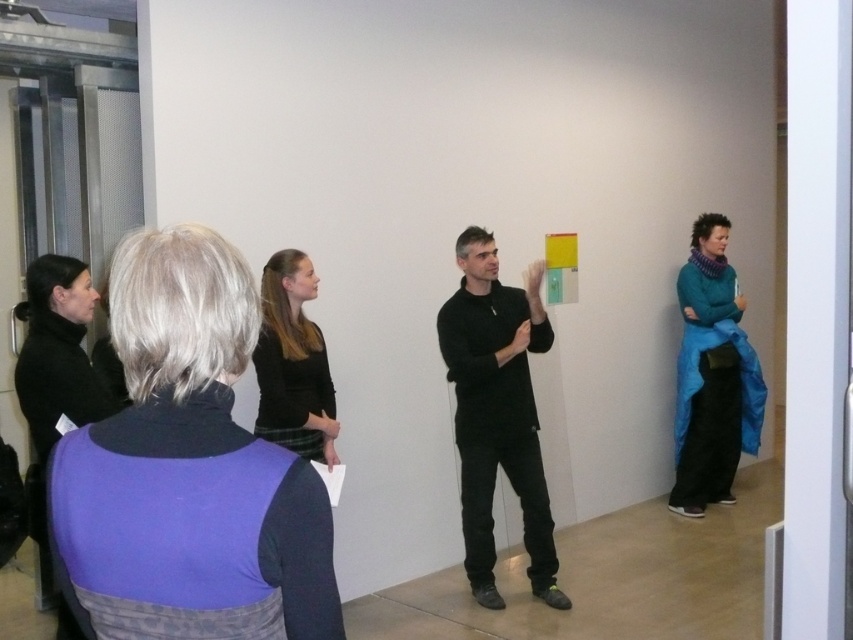
You are an art gallery visitor who wants to take a photo of the blue fabric coat at right without including the black matte shirt at center in the frame. Is it possible to do so by moving only to your right side?

The black matte shirt at center is to the left of blue fabric coat at right, so moving to your right side may allow you to exclude the black matte shirt at center from the frame depending on the distance between them and your camera angle.

You are an artist trying to decide where to place your new sculpture in the gallery. You have two options near the purple fabric vest at lower left and the blue fabric coat at right. Which location is closer to the left wall?

The purple fabric vest at lower left is to the left of the blue fabric coat at right, so the location near the purple fabric vest at lower left is closer to the left wall.